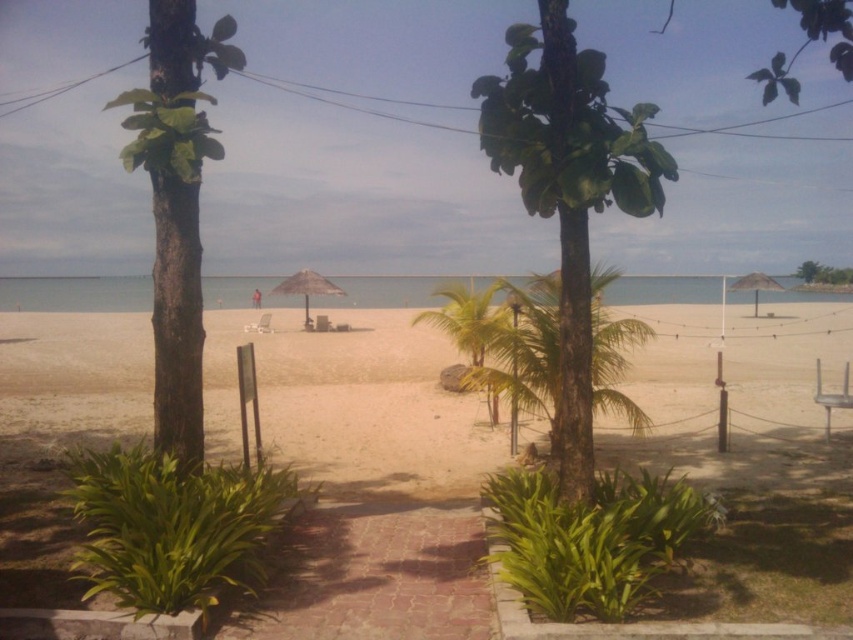
You are standing on the beach and see a point marked at coordinates (569, 188). According to the scene, what object is located at this point?

The point at coordinates (569, 188) corresponds to the green leafy tree at center.

You are standing at the entrance of the pathway between the two trees. You want to walk straight ahead towards the ocean. Will the green leafy tree at upper right or the beige fabric umbrella at right be on your left side as you walk?

The green leafy tree at upper right is to the right of the beige fabric umbrella at right. When walking straight ahead towards the ocean from the pathway between the trees, the beige fabric umbrella at right will be on your left side, while the green leafy tree at upper right will be on your right side.

You are a photographer setting up a shot of the beach scene. You want to ensure both the green leafy tree at upper right and the beige fabric umbrella at right are in the frame. Which object should you adjust your camera angle to focus on first to capture their relative sizes accurately?

The green leafy tree at upper right has a lesser width compared to the beige fabric umbrella at right, so you should focus on the beige fabric umbrella at right first to account for its larger size in the composition.